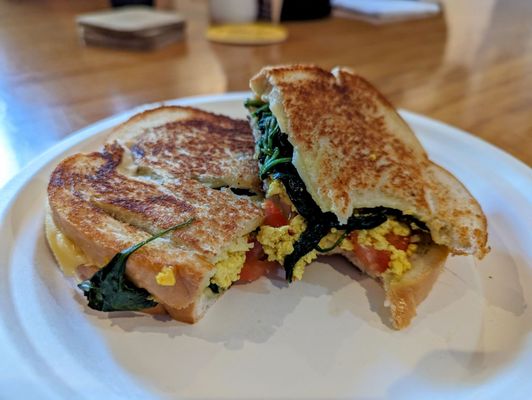
Find the location of `paper pad`. paper pad is located at coordinates (368, 18).